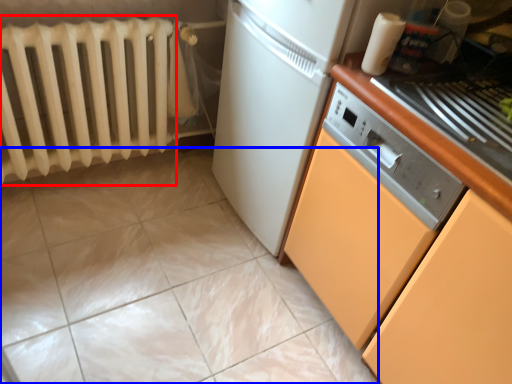
Question: Which object is closer to the camera taking this photo, radiator (highlighted by a red box) or ceramic tile (highlighted by a blue box)?

Choices:
 (A) radiator
 (B) ceramic tile

Answer: (B)